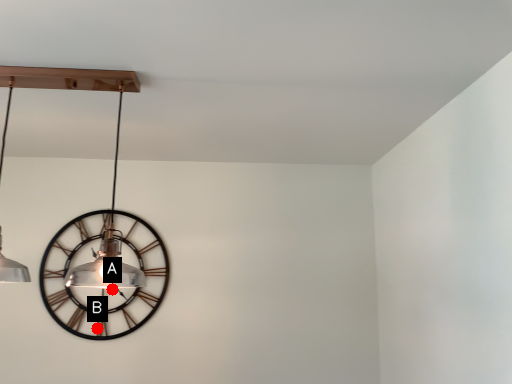
Question: Two points are circled on the image, labeled by A and B beside each circle. Which point is farther from the camera taking this photo?

Choices:
 (A) A is further
 (B) B is further

Answer: (A)